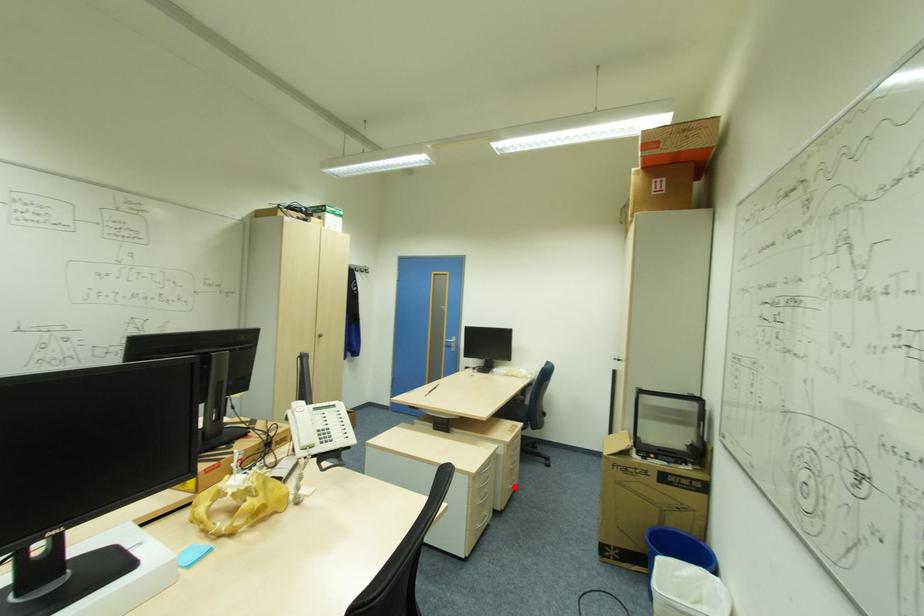
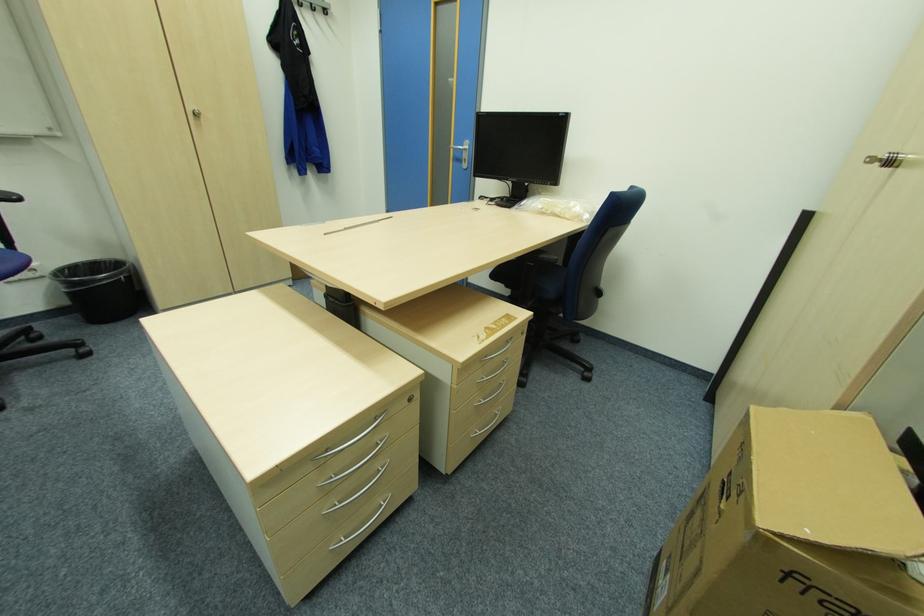
Question: I am providing you with two images of the same scene from different viewpoints. Given a red point in image1, look at the same physical point in image2. Is it:

Choices:
 (A) Closer to the viewpoint
 (B) Farther from the viewpoint

Answer: (A)